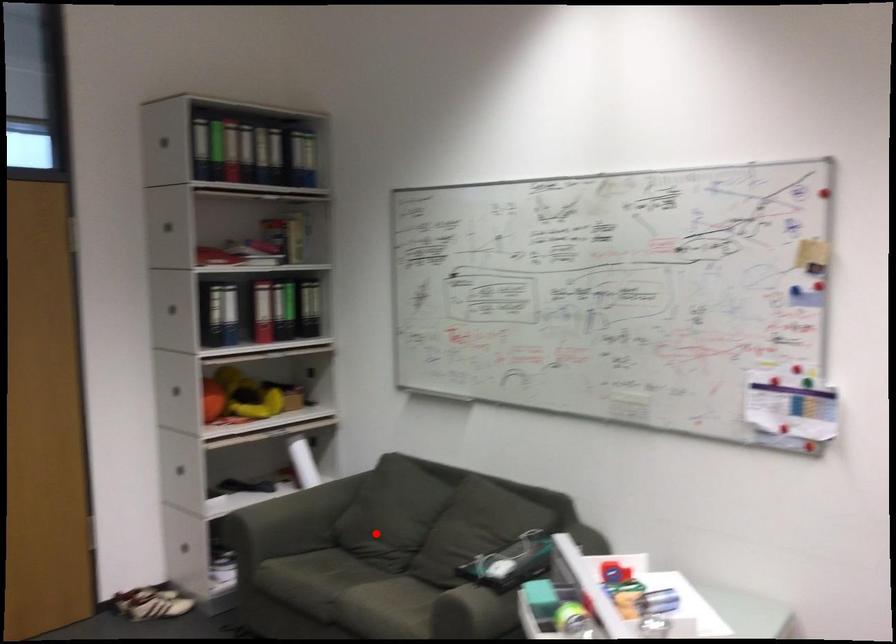
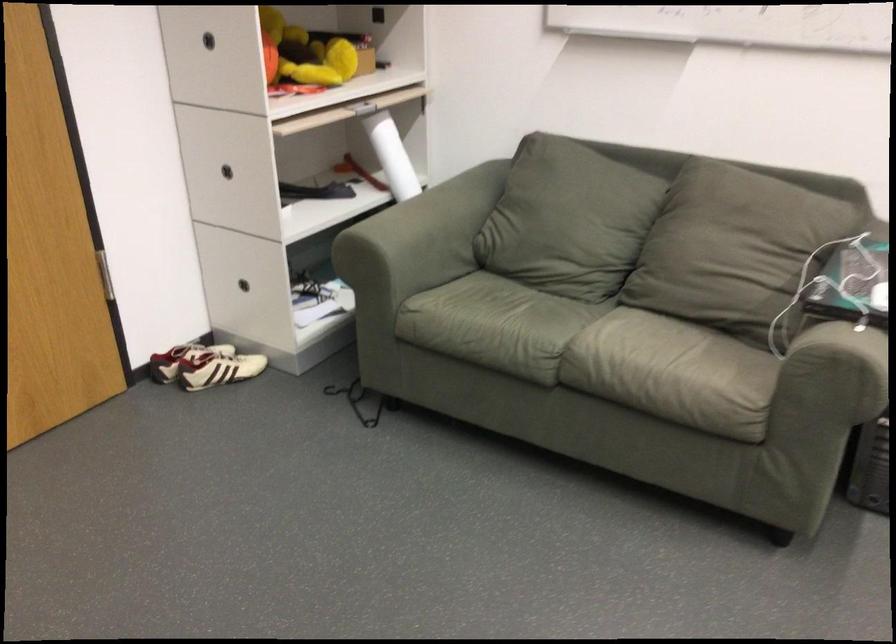
Find the pixel in the second image that matches the highlighted location in the first image.

(558, 232)